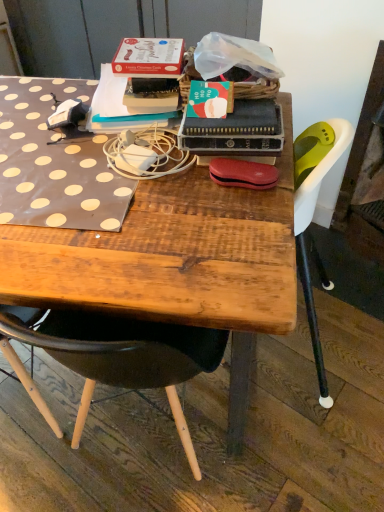
Image resolution: width=384 pixels, height=512 pixels. Identify the location of vacant area that is in front of hardcover book at center. (219, 204).